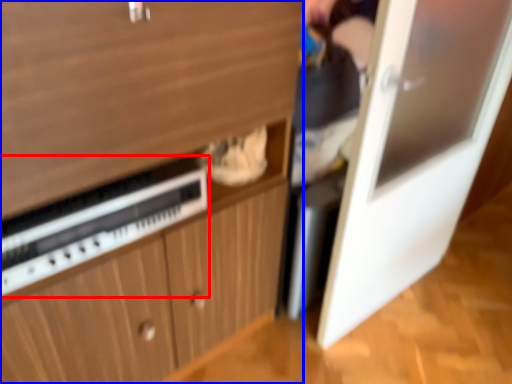
Question: Among these objects, which one is farthest to the camera, appliance (highlighted by a red box) or cabinetry (highlighted by a blue box)?

Choices:
 (A) appliance
 (B) cabinetry

Answer: (A)